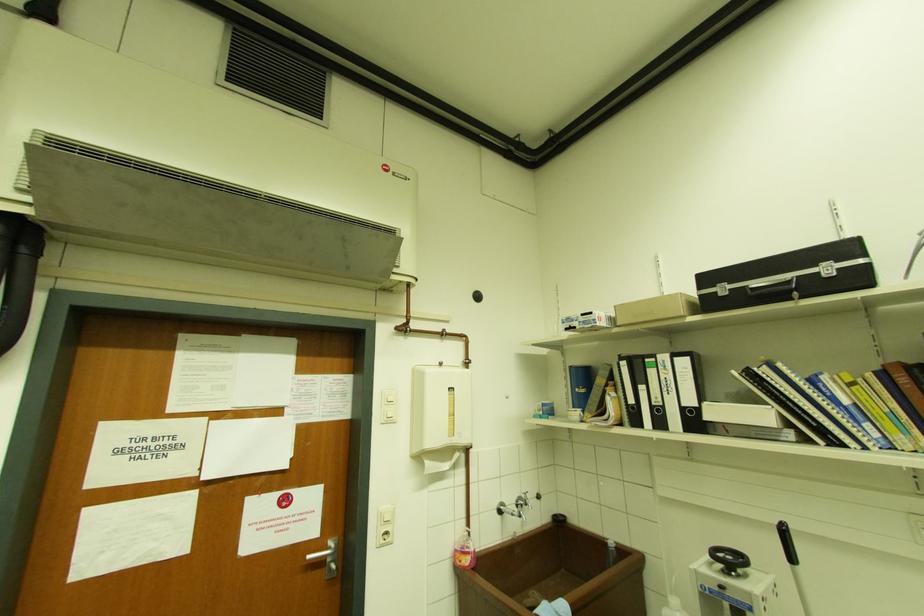
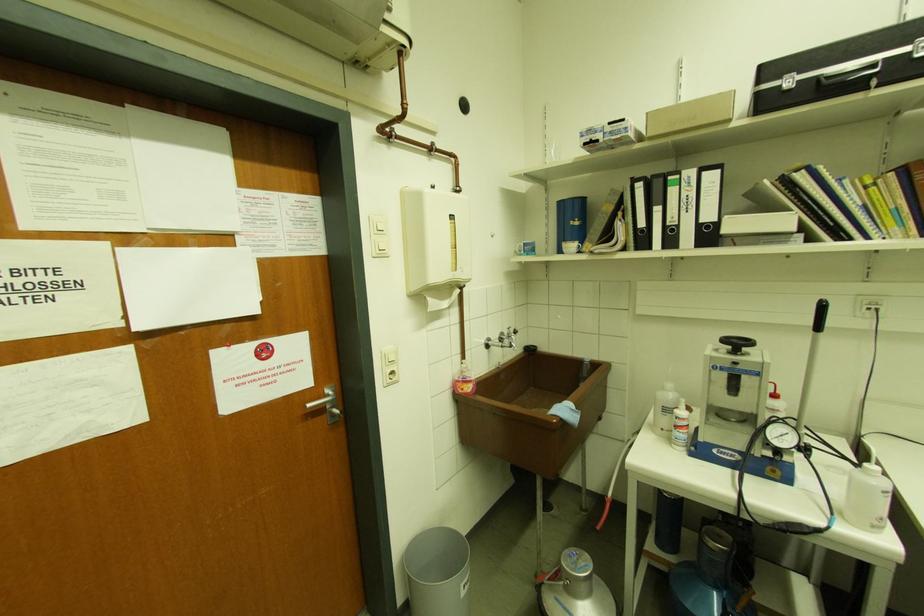
Where in the second image is the point corresponding to point 693,402 from the first image?

(712, 217)